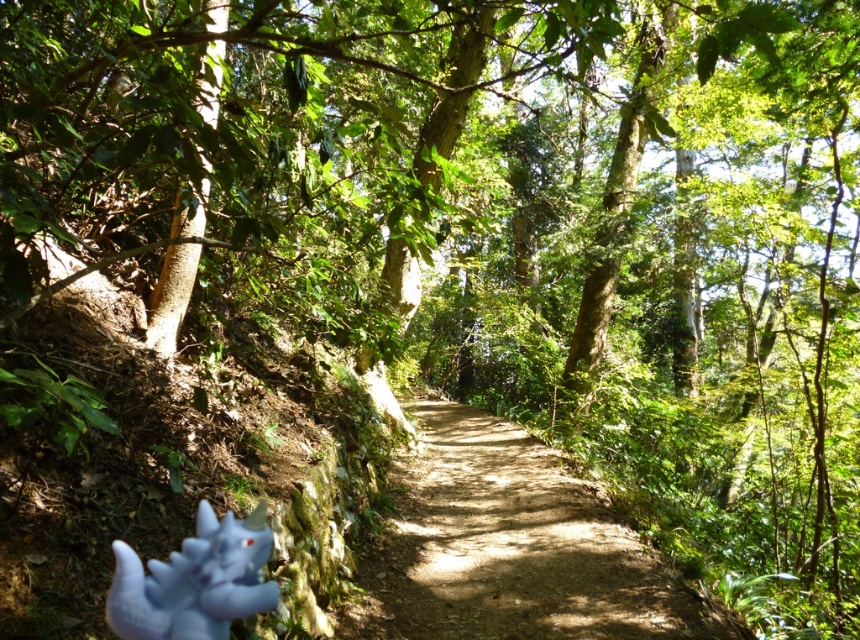
From the picture: Can you confirm if dirt path at center is thinner than blue plush toy at lower left?

No, dirt path at center is not thinner than blue plush toy at lower left.

Is point (494, 602) closer to viewer compared to point (241, 557)?

No.

What do you see at coordinates (510, 547) in the screenshot? I see `dirt path at center` at bounding box center [510, 547].

Find the location of a particular element. This screenshot has height=640, width=860. dirt path at center is located at coordinates (510, 547).